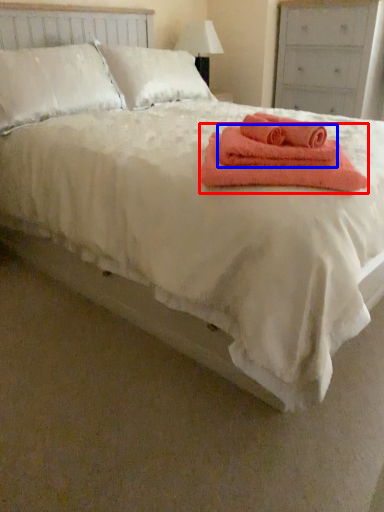
Question: Among these objects, which one is farthest to the camera, towel (highlighted by a red box) or bath towel (highlighted by a blue box)?

Choices:
 (A) towel
 (B) bath towel

Answer: (B)